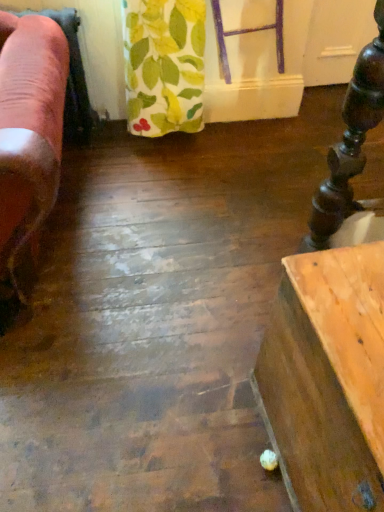
Describe the element at coordinates (327, 378) in the screenshot. Image resolution: width=384 pixels, height=512 pixels. I see `light brown wooden table at lower right` at that location.

You are a GUI agent. You are given a task and a screenshot of the screen. Output one action in this format:
    pyautogui.click(x=<x>, y=<y>)
    Task: Click on the light brown wooden table at lower right
    This screenshot has width=384, height=512.
    Given the screenshot: What is the action you would take?
    pyautogui.click(x=327, y=378)

You are a GUI agent. You are given a task and a screenshot of the screen. Output one action in this format:
    pyautogui.click(x=<x>, y=<y>)
    Task: Click on the light brown wooden table at lower right
    This screenshot has height=512, width=384.
    Given the screenshot: What is the action you would take?
    pyautogui.click(x=327, y=378)